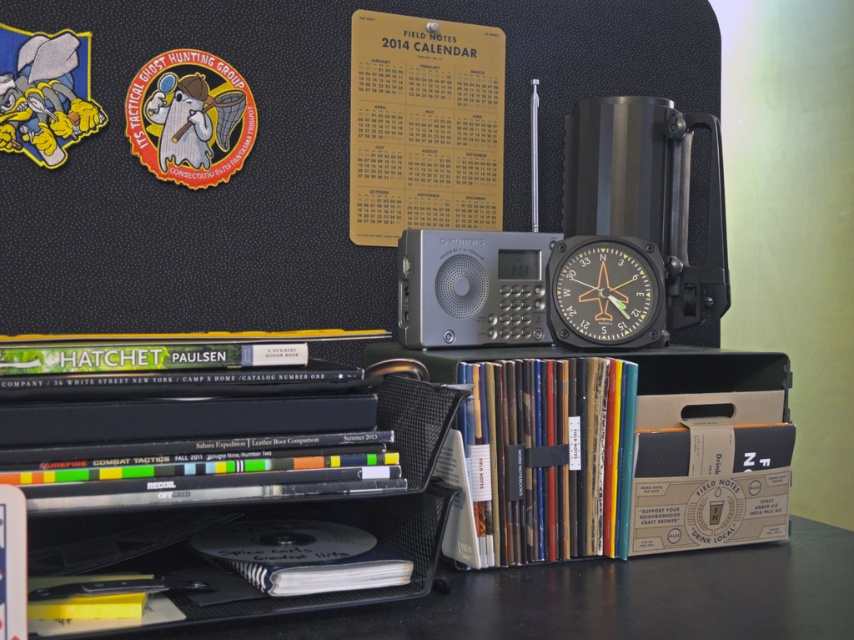
You are organizing items on a dark desk and need to place a new item between the cardboard box at center and the calendar. Where should you place it?

The cardboard box at center is located at point [623,445]. Since the calendar is to the right of the ghost sticker, you should place the new item between these two points along the horizontal axis.

You are organizing items on a desk and see the cardboard box at center and the matte black compass at center. Which object is located to the left of the other?

The cardboard box at center is positioned on the left side of the matte black compass at center.

You are setting up a desk organizer and need to place the black mesh organizer at lower left and the matte black compass at center. Which object is shorter in height?

The black mesh organizer at lower left is shorter in height compared to the matte black compass at center.